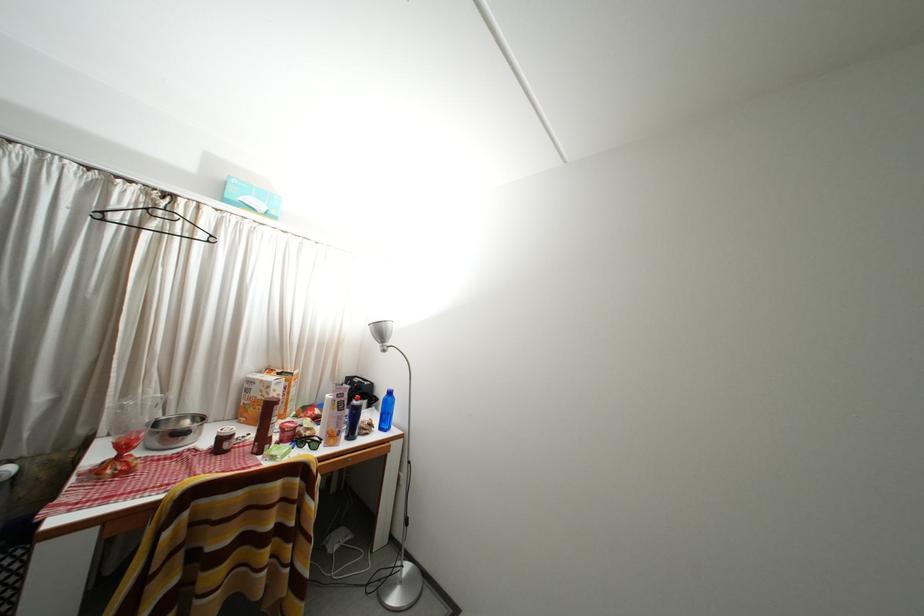
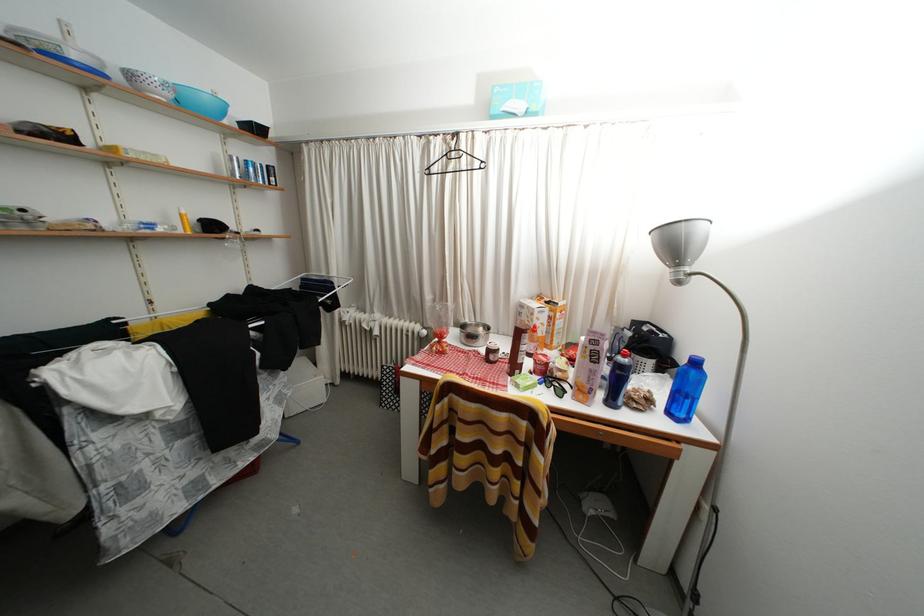
The point at (359, 442) is marked in the first image. Where is the corresponding point in the second image?

(618, 408)